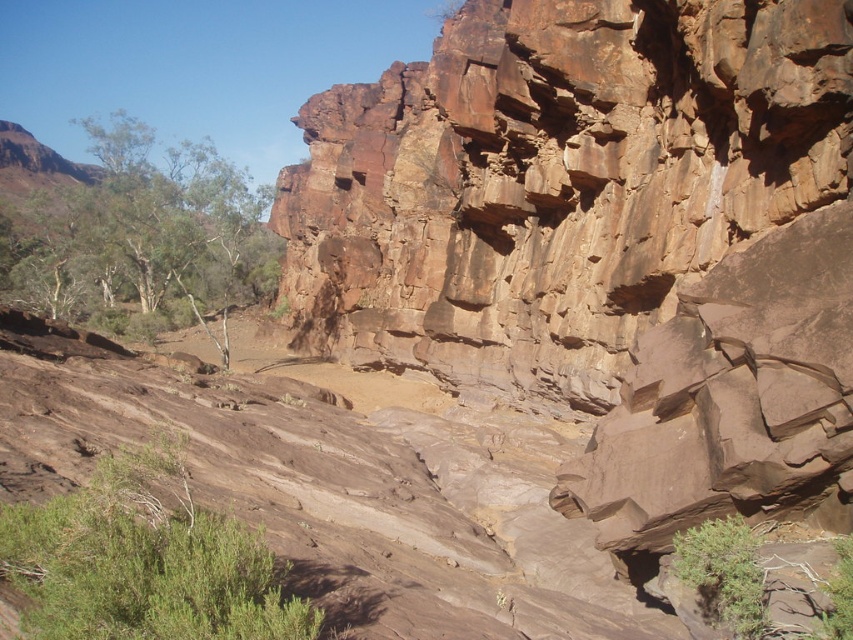
Which is more to the right, green leafy tree at upper left or green leafy shrub at lower left?

Positioned to the right is green leafy shrub at lower left.

Who is more forward, (41, 232) or (166, 520)?

Point (166, 520)

Where is `green leafy tree at upper left`? This screenshot has height=640, width=853. green leafy tree at upper left is located at coordinates tap(132, 228).

Is point (560, 70) less distant than point (123, 502)?

No, (560, 70) is further to viewer.

Which is behind, point (560, 310) or point (115, 544)?

Point (560, 310)

I want to click on brown rough rock face at upper center, so click(555, 180).

Does brown rough rock face at upper center have a lesser height compared to green leafy tree at upper left?

Correct, brown rough rock face at upper center is not as tall as green leafy tree at upper left.

Who is more distant from viewer, (474,273) or (207,227)?

Point (207,227)

Find the location of a particular element. brown rough rock face at upper center is located at coordinates (555, 180).